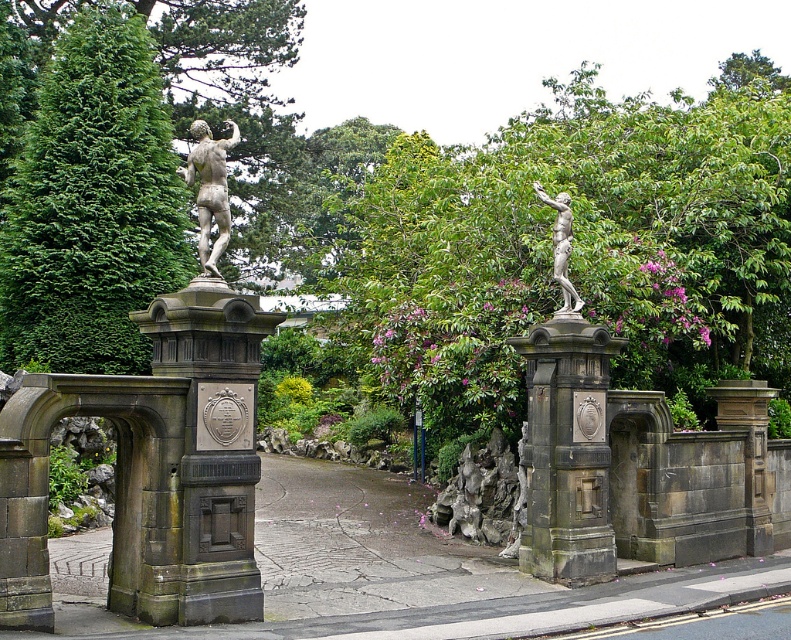
Does green leafy tree at center have a greater width compared to stone statue at center?

Yes, green leafy tree at center is wider than stone statue at center.

Can you confirm if green leafy tree at center is taller than stone statue at center?

Yes.

Between point (733, 317) and point (559, 390), which one is positioned in front?

Positioned in front is point (559, 390).

Find the location of a particular element. The height and width of the screenshot is (640, 791). green leafy tree at center is located at coordinates (576, 248).

Is point (33, 314) farther from viewer compared to point (210, 372)?

Yes, point (33, 314) is behind point (210, 372).

Is green leafy tree at left shorter than dark gray stone gate at center?

No.

Is point (80, 67) farther from camera compared to point (186, 483)?

Yes, it is behind point (186, 483).

Where is `green leafy tree at left`? The width and height of the screenshot is (791, 640). green leafy tree at left is located at coordinates (93, 205).

Describe the element at coordinates (93, 205) in the screenshot. I see `green leafy tree at left` at that location.

Is green leafy tree at left taller than bronze statue at upper center?

Correct, green leafy tree at left is much taller as bronze statue at upper center.

Which is behind, point (150, 163) or point (534, 186)?

Point (150, 163)

The image size is (791, 640). I want to click on green leafy tree at left, so click(x=93, y=205).